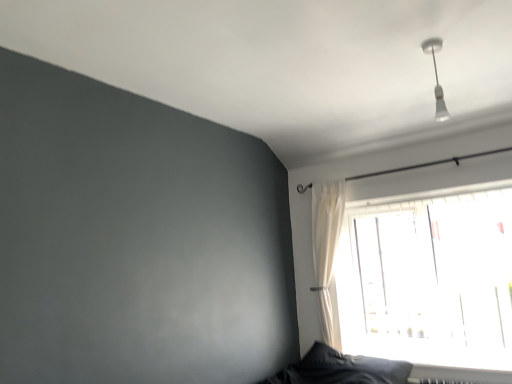
Question: Is white glossy light fixture at upper right shorter than dark gray fabric pillow at lower right?

Choices:
 (A) no
 (B) yes

Answer: (B)

Question: Is white glossy light fixture at upper right aimed at dark gray fabric pillow at lower right?

Choices:
 (A) no
 (B) yes

Answer: (A)

Question: From the image's perspective, does white glossy light fixture at upper right appear higher than dark gray fabric pillow at lower right?

Choices:
 (A) no
 (B) yes

Answer: (B)

Question: Can you confirm if white glossy light fixture at upper right is wider than dark gray fabric pillow at lower right?

Choices:
 (A) yes
 (B) no

Answer: (B)

Question: Is the position of white glossy light fixture at upper right more distant than that of dark gray fabric pillow at lower right?

Choices:
 (A) yes
 (B) no

Answer: (B)

Question: Considering the positions of white glossy light fixture at upper right and dark gray fabric pillow at lower right in the image, is white glossy light fixture at upper right taller or shorter than dark gray fabric pillow at lower right?

Choices:
 (A) short
 (B) tall

Answer: (A)

Question: Is white glossy light fixture at upper right in front of or behind dark gray fabric pillow at lower right in the image?

Choices:
 (A) front
 (B) behind

Answer: (A)

Question: From the image's perspective, is white glossy light fixture at upper right above or below dark gray fabric pillow at lower right?

Choices:
 (A) above
 (B) below

Answer: (A)

Question: Considering the positions of white glossy light fixture at upper right and dark gray fabric pillow at lower right in the image, is white glossy light fixture at upper right bigger or smaller than dark gray fabric pillow at lower right?

Choices:
 (A) small
 (B) big

Answer: (A)

Question: From the image's perspective, is dark gray fabric pillow at lower right above or below white sheer curtain at upper right?

Choices:
 (A) above
 (B) below

Answer: (B)

Question: Is dark gray fabric pillow at lower right to the left or to the right of white sheer curtain at upper right in the image?

Choices:
 (A) left
 (B) right

Answer: (B)

Question: Is dark gray fabric pillow at lower right wider or thinner than white sheer curtain at upper right?

Choices:
 (A) wide
 (B) thin

Answer: (A)

Question: Choose the correct answer: Is dark gray fabric pillow at lower right inside white sheer curtain at upper right or outside it?

Choices:
 (A) inside
 (B) outside

Answer: (B)

Question: In the image, is dark gray fabric pillow at lower right positioned in front of or behind transparent glass window at upper right?

Choices:
 (A) behind
 (B) front

Answer: (A)

Question: Is dark gray fabric pillow at lower right inside the boundaries of transparent glass window at upper right, or outside?

Choices:
 (A) outside
 (B) inside

Answer: (A)